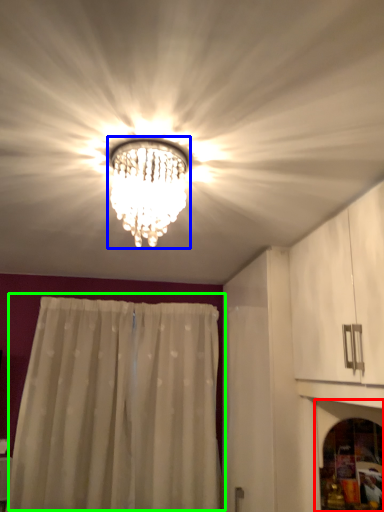
Question: Which object is positioned closest to screen door (highlighted by a red box)? Select from lamp (highlighted by a blue box) and curtain (highlighted by a green box).

Choices:
 (A) lamp
 (B) curtain

Answer: (A)